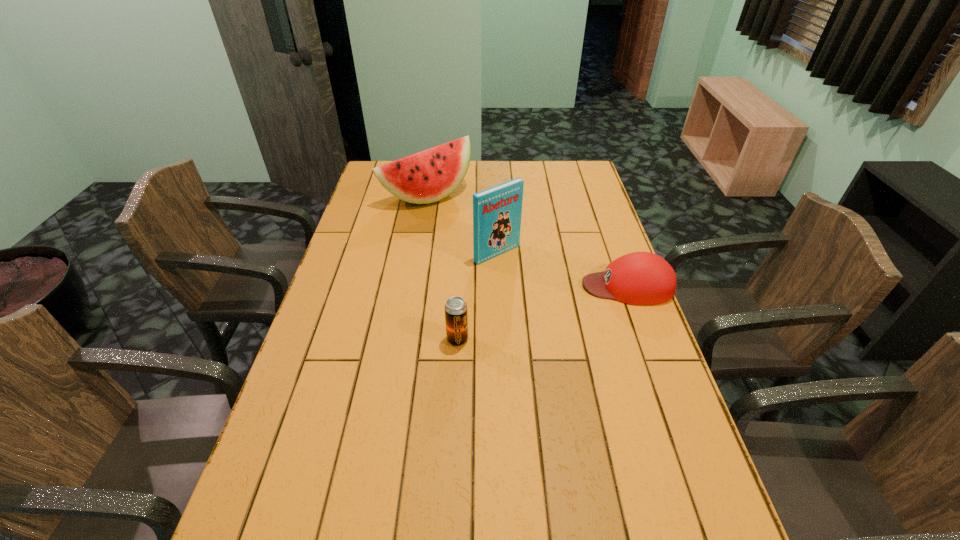
Identify the location of beer can. The height and width of the screenshot is (540, 960). (456, 317).

Where is `the second shortest object`? The height and width of the screenshot is (540, 960). the second shortest object is located at coordinates (456, 317).

Identify the location of the third farthest object. This screenshot has height=540, width=960. (640, 278).

Identify the location of the rightmost object. (640, 278).

Locate an element on the screen. The height and width of the screenshot is (540, 960). the third shortest object is located at coordinates (429, 176).

This screenshot has height=540, width=960. I want to click on the farthest object, so click(429, 176).

In order to click on book in this screenshot , I will do `click(497, 211)`.

The image size is (960, 540). Find the location of `the third nearest object`. the third nearest object is located at coordinates (497, 211).

Locate an element on the screen. Image resolution: width=960 pixels, height=540 pixels. free space located 0.350m on the right of the beer can is located at coordinates (598, 339).

This screenshot has width=960, height=540. I want to click on vacant space positioned on the front-facing side of the shortest object, so click(487, 286).